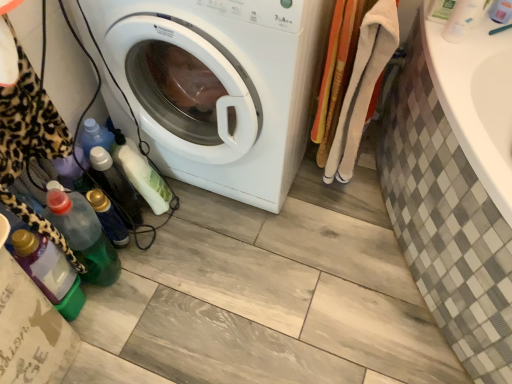
Where is `blank space to the left of soft cotton towels at right`? The width and height of the screenshot is (512, 384). blank space to the left of soft cotton towels at right is located at coordinates (290, 193).